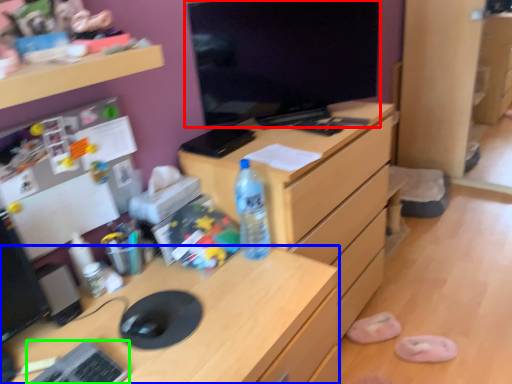
Question: Estimate the real-world distances between objects in this image. Which object is farther from computer monitor (highlighted by a red box), desk (highlighted by a blue box) or keyboard (highlighted by a green box)?

Choices:
 (A) desk
 (B) keyboard

Answer: (B)